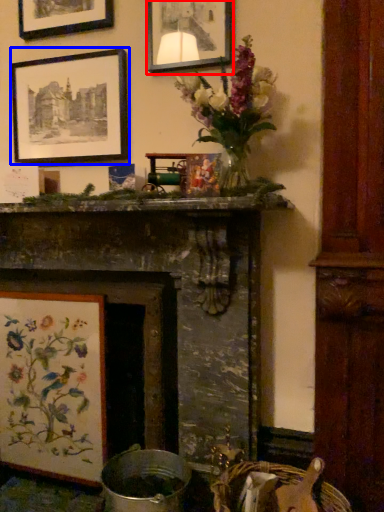
Question: Which object is further to the camera taking this photo, picture frame (highlighted by a red box) or picture frame (highlighted by a blue box)?

Choices:
 (A) picture frame
 (B) picture frame

Answer: (B)